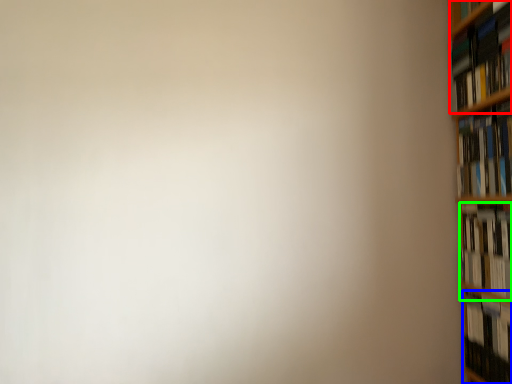
Question: Based on their relative distances, which object is farther from book (highlighted by a red box)? Choose from book (highlighted by a blue box) and book (highlighted by a green box).

Choices:
 (A) book
 (B) book

Answer: (A)